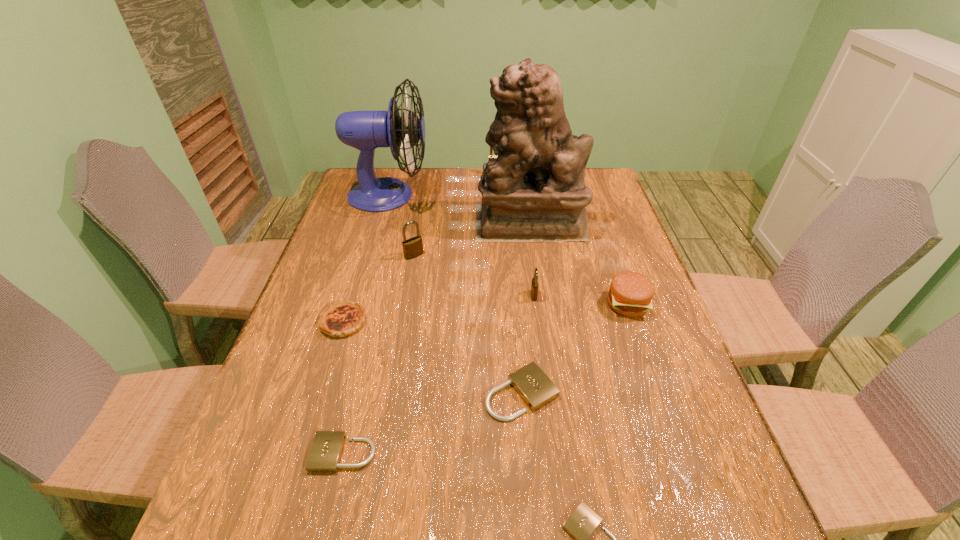
You are a GUI agent. You are given a task and a screenshot of the screen. Output one action in this format:
    pyautogui.click(x=<x>, y=<y>)
    Task: Click on the free space between the quiche and the hamburger
    
    Given the screenshot: What is the action you would take?
    pyautogui.click(x=486, y=313)

At what (x,y) coordinates should I click in order to perform the action: click on free area in between the farthest beige padlock and the quiche. Please return your answer as a coordinate pair (x, y). Looking at the image, I should click on (433, 357).

Identify the location of unoccupied position between the sculpture and the second nearest brass padlock. (472, 238).

Image resolution: width=960 pixels, height=540 pixels. Identify the location of vacant space that's between the fifth shortest object and the biggest beige padlock. (574, 348).

Find the location of a particular element. This screenshot has width=960, height=540. object that is the sixth nearest to the shortest padlock is located at coordinates (413, 247).

The image size is (960, 540). I want to click on object that is the fourth closest to the fan, so click(x=339, y=319).

Identify the location of the third closest padlock to the fifth shortest object. (582, 523).

Identify which padlock is located as the second nearest to the fifth shortest object. Please provide its 2D coordinates. Your answer should be formatted as a tuple, i.e. [(x, y)], where the tuple contains the x and y coordinates of a point satisfying the conditions above.

[(536, 389)]

Find the location of a particular element. The height and width of the screenshot is (540, 960). brass padlock identified as the closest to the ninth shortest object is located at coordinates (413, 247).

This screenshot has height=540, width=960. Identify the location of the closest brass padlock relative to the seventh shortest object. (534, 286).